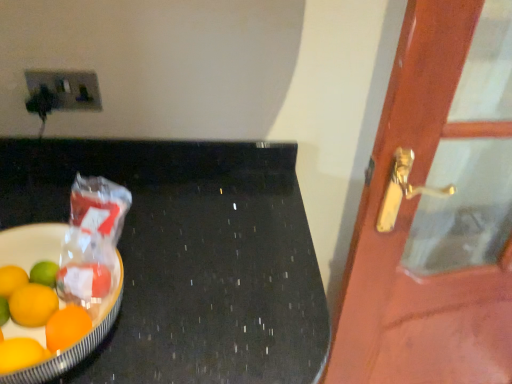
Question: Is point (72, 92) positioned closer to the camera than point (128, 193)?

Choices:
 (A) farther
 (B) closer

Answer: (A)

Question: Which is correct: matte plastic socket at upper left is inside shiny plastic bowl at left, or outside of it?

Choices:
 (A) outside
 (B) inside

Answer: (A)

Question: Based on their relative distances, which object is nearer to the matte plastic socket at upper left?

Choices:
 (A) black polished table at left
 (B) shiny plastic bowl at left
 (C) wooden door at right

Answer: (A)

Question: Estimate the real-world distances between objects in this image. Which object is closer to the matte plastic socket at upper left?

Choices:
 (A) shiny plastic bowl at left
 (B) wooden door at right
 (C) black polished table at left

Answer: (C)